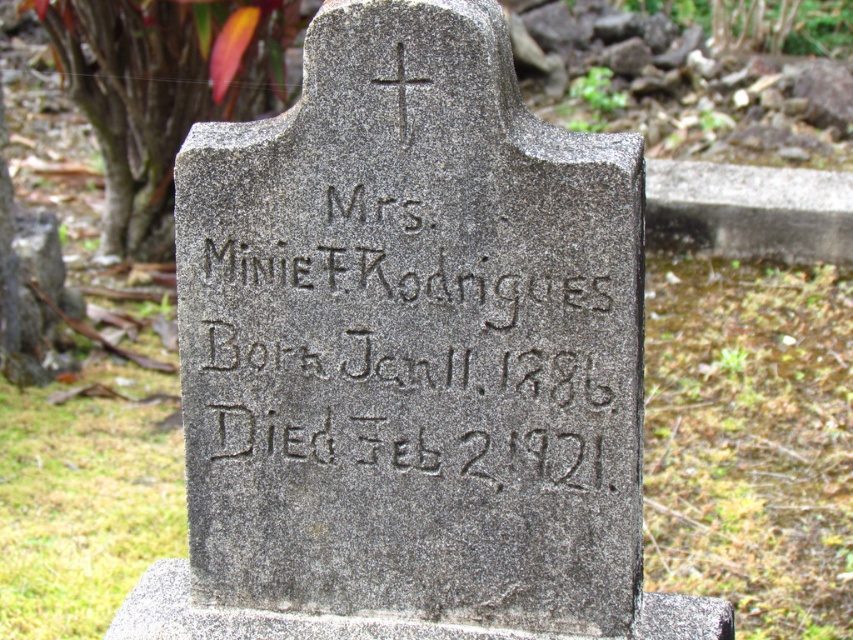
Can you confirm if gray stone gravestone at center is taller than gray stone inscription at center?

Yes, gray stone gravestone at center is taller than gray stone inscription at center.

Who is shorter, gray stone gravestone at center or gray stone inscription at center?

gray stone inscription at center is shorter.

What do you see at coordinates (409, 356) in the screenshot? I see `gray stone gravestone at center` at bounding box center [409, 356].

Locate an element on the screen. gray stone gravestone at center is located at coordinates (409, 356).